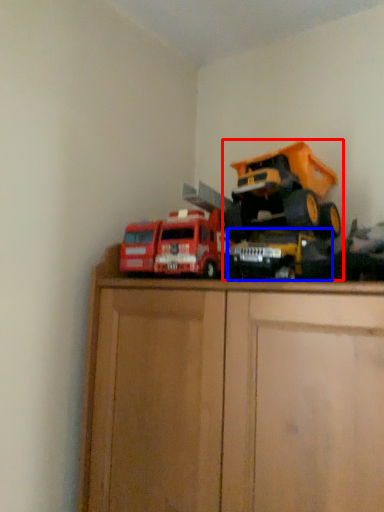
Question: Which of the following is the closest to the observer, toy (highlighted by a red box) or toy (highlighted by a blue box)?

Choices:
 (A) toy
 (B) toy

Answer: (B)